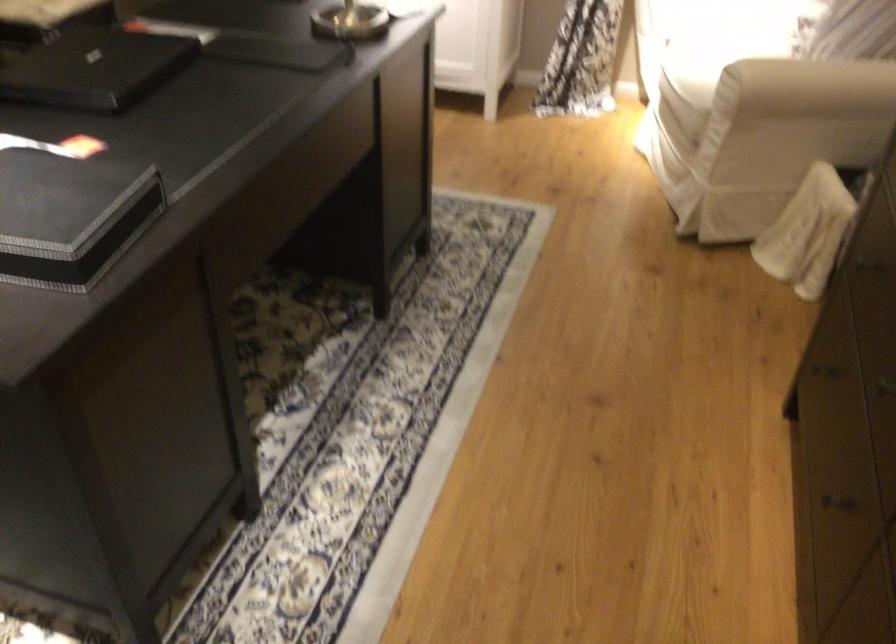
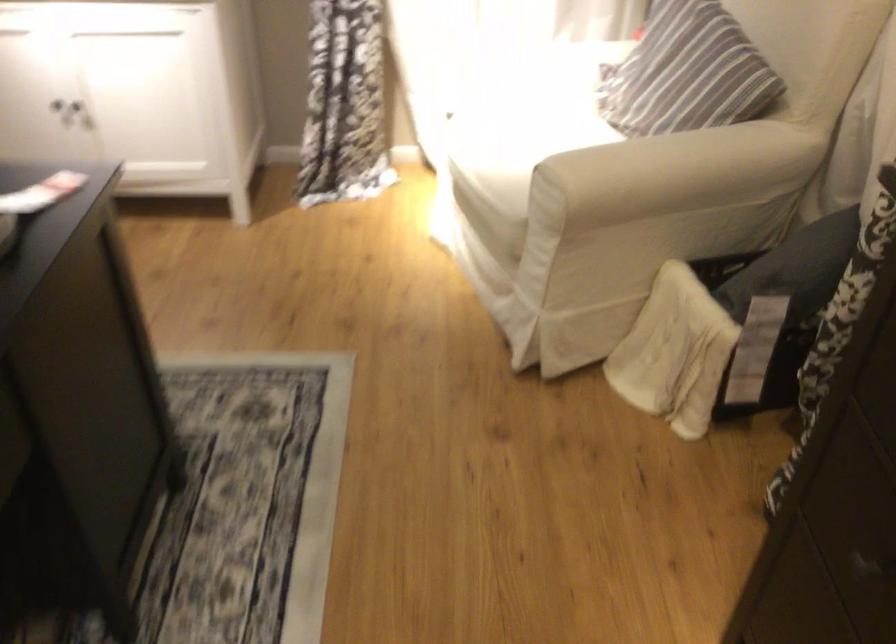
Question: How did the camera likely rotate?

Choices:
 (A) Left
 (B) Right
 (C) Up
 (D) Down

Answer: (B)